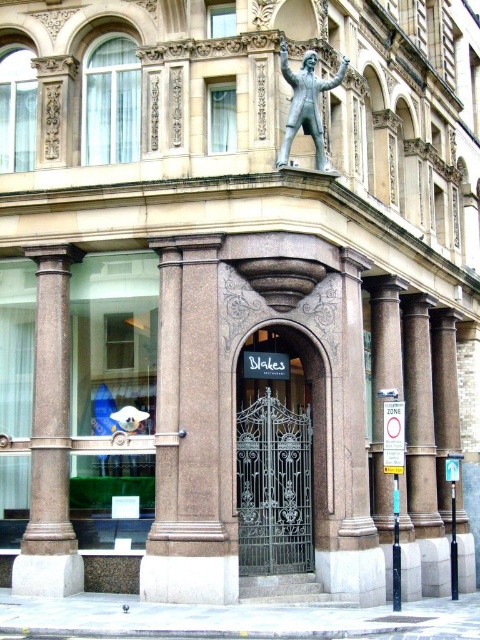
Is brown polished stone column at left to the left of silver/statue at upper center from the viewer's perspective?

Yes, brown polished stone column at left is to the left of silver/statue at upper center.

Is brown polished stone column at left thinner than silver/statue at upper center?

In fact, brown polished stone column at left might be wider than silver/statue at upper center.

At what (x,y) coordinates should I click in order to perform the action: click on brown polished stone column at left. Please return your answer as a coordinate pair (x, y). Image resolution: width=480 pixels, height=640 pixels. Looking at the image, I should click on (49, 440).

Find the location of a particular element. brown polished stone column at left is located at coordinates (49, 440).

Which is in front, point (164, 340) or point (48, 404)?

Positioned in front is point (164, 340).

Who is lower down, sanded stone column at center or brown polished stone column at left?

brown polished stone column at left is lower down.

The height and width of the screenshot is (640, 480). Find the location of `sanded stone column at center`. sanded stone column at center is located at coordinates (188, 435).

What are the coordinates of `sanded stone column at center` in the screenshot? It's located at (188, 435).

Who is more forward, (321, 397) or (321, 144)?

Point (321, 144) is more forward.

Is green wrought iron gate at center thinner than silver/statue at upper center?

No, green wrought iron gate at center is not thinner than silver/statue at upper center.

Is point (251, 374) behind point (288, 125)?

That is True.

Find the location of a particular element. The image size is (480, 640). green wrought iron gate at center is located at coordinates (277, 451).